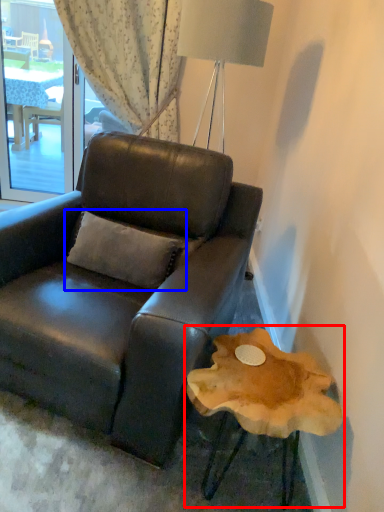
Question: Among these objects, which one is farthest to the camera, round table (highlighted by a red box) or pillow (highlighted by a blue box)?

Choices:
 (A) round table
 (B) pillow

Answer: (B)